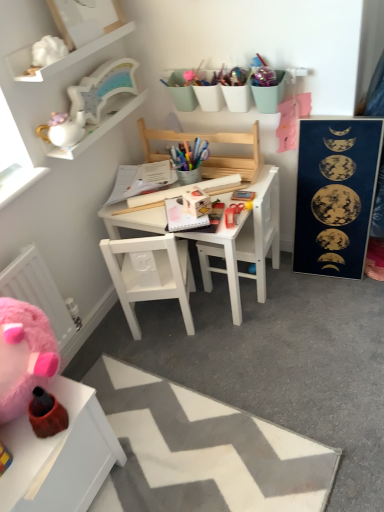
Find the location of a particular element. The width and height of the screenshot is (384, 512). vacant space that's between white wooden table at center, which is counted as the 1th table, starting from the back, and white zigzag rug at lower center is located at coordinates (243, 359).